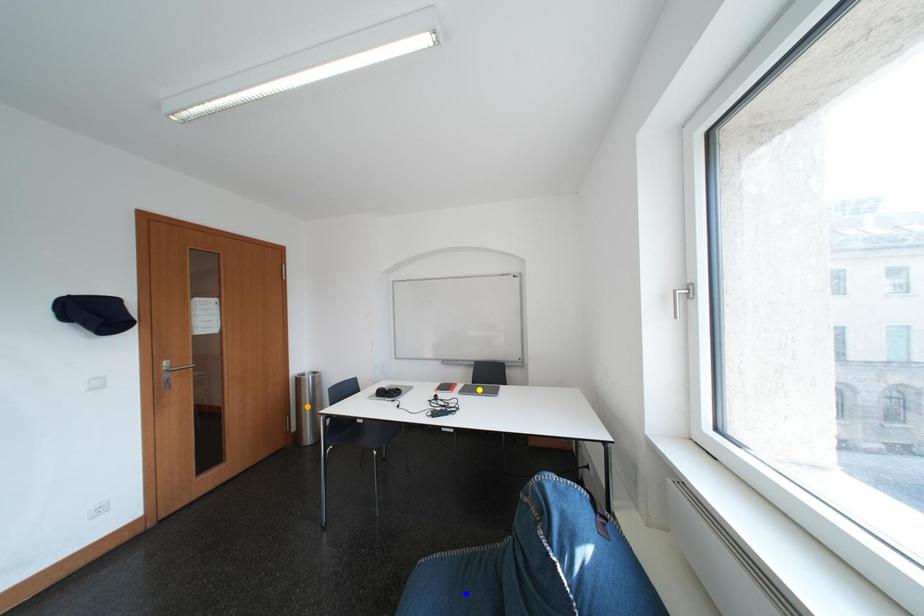
Looking at this image, order these from nearest to farthest:
yellow point
orange point
blue point

1. yellow point
2. orange point
3. blue point